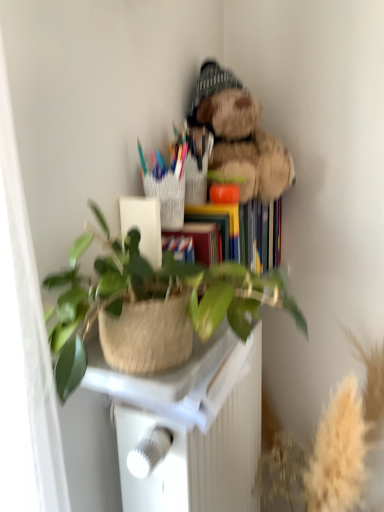
Describe the element at coordinates (154, 296) in the screenshot. I see `green woven basket at center` at that location.

What is the approximate height of white plastic table at center?

The height of white plastic table at center is 24.82 inches.

Where is `fuzzy brown teddy bear at upper right`? fuzzy brown teddy bear at upper right is located at coordinates (x=239, y=135).

How many degrees apart are the facing directions of white plastic table at center and fuzzy brown teddy bear at upper right?

They differ by 0.2 degrees in their facing directions.

Is white plastic table at center not close to fuzzy brown teddy bear at upper right?

white plastic table at center is actually quite close to fuzzy brown teddy bear at upper right.

Which object is thinner, white plastic table at center or fuzzy brown teddy bear at upper right?

With smaller width is white plastic table at center.

Which of these two, green woven basket at center or fuzzy brown teddy bear at upper right, is smaller?

Smaller between the two is fuzzy brown teddy bear at upper right.

Find the location of a particular element. The height and width of the screenshot is (512, 384). houseplant below the fuzzy brown teddy bear at upper right (from a real-world perspective) is located at coordinates (154, 296).

From a real-world perspective, which is physically below, green woven basket at center or fuzzy brown teddy bear at upper right?

In real-world perspective, green woven basket at center is lower.

Considering the sizes of objects green woven basket at center and fuzzy brown teddy bear at upper right in the image provided, who is taller, green woven basket at center or fuzzy brown teddy bear at upper right?

Standing taller between the two is fuzzy brown teddy bear at upper right.

From a real-world perspective, between green woven basket at center and white plastic table at center, who is vertically higher?

From a 3D spatial view, green woven basket at center is above.

Does green woven basket at center have a greater width compared to white plastic table at center?

Indeed, green woven basket at center has a greater width compared to white plastic table at center.

Which is more to the right, green woven basket at center or white plastic table at center?

white plastic table at center.

Could you tell me if fuzzy brown teddy bear at upper right is turned towards white plastic table at center?

No.

Does fuzzy brown teddy bear at upper right have a greater height compared to white plastic table at center?

Incorrect, the height of fuzzy brown teddy bear at upper right is not larger of that of white plastic table at center.

Who is smaller, fuzzy brown teddy bear at upper right or white plastic table at center?

fuzzy brown teddy bear at upper right.

Between point (220, 99) and point (111, 279), which one is positioned in front?

The point (111, 279) is in front.

Find the location of a particular element. This screenshot has height=512, width=384. teddy bear above the green woven basket at center (from a real-world perspective) is located at coordinates (239, 135).

Which of these two, fuzzy brown teddy bear at upper right or green woven basket at center, stands shorter?

With less height is green woven basket at center.

Based on their positions, is fuzzy brown teddy bear at upper right located to the left or right of green woven basket at center?

In the image, fuzzy brown teddy bear at upper right appears on the right side of green woven basket at center.

From the picture: From the image's perspective, does white plastic table at center appear lower than green woven basket at center?

Yes, from the image's perspective, white plastic table at center is beneath green woven basket at center.

Considering the relative sizes of white plastic table at center and green woven basket at center in the image provided, is white plastic table at center thinner than green woven basket at center?

Yes, white plastic table at center is thinner than green woven basket at center.

Which of these two, white plastic table at center or green woven basket at center, is bigger?

white plastic table at center.

Which is more to the right, white plastic table at center or green woven basket at center?

white plastic table at center is more to the right.

The image size is (384, 512). I want to click on table that appears on the left of fuzzy brown teddy bear at upper right, so click(191, 425).

Identify the location of houseplant below the fuzzy brown teddy bear at upper right (from the image's perspective). (154, 296).

From the image, which object appears to be farther from fuzzy brown teddy bear at upper right, green woven basket at center or white plastic table at center?

white plastic table at center is further to fuzzy brown teddy bear at upper right.

Looking at the image, which one is located closer to white plastic table at center, fuzzy brown teddy bear at upper right or green woven basket at center?

green woven basket at center is positioned closer to the anchor white plastic table at center.

Looking at the image, which one is located closer to green woven basket at center, fuzzy brown teddy bear at upper right or white plastic table at center?

Among the two, white plastic table at center is located nearer to green woven basket at center.

Considering their positions, is white plastic table at center positioned further to fuzzy brown teddy bear at upper right than green woven basket at center?

white plastic table at center is further to fuzzy brown teddy bear at upper right.

Looking at the image, which one is located further to green woven basket at center, white plastic table at center or fuzzy brown teddy bear at upper right?

fuzzy brown teddy bear at upper right is further to green woven basket at center.

Looking at the image, which one is located further to white plastic table at center, green woven basket at center or fuzzy brown teddy bear at upper right?

fuzzy brown teddy bear at upper right.

This screenshot has height=512, width=384. In order to click on houseplant that lies between fuzzy brown teddy bear at upper right and white plastic table at center from top to bottom in this screenshot , I will do `click(154, 296)`.